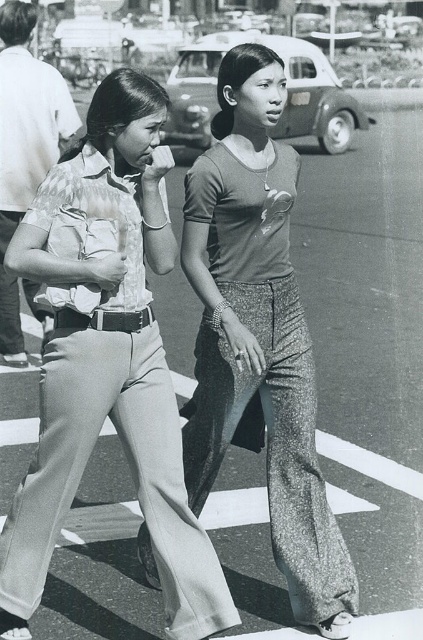
Question: Which of the following is the farthest from the observer?

Choices:
 (A) matte beige pants at center
 (B) matte gray pants at center

Answer: (B)

Question: Where is matte beige pants at center located in relation to matte gray pants at center in the image?

Choices:
 (A) right
 (B) left

Answer: (B)

Question: Is matte beige pants at center positioned at the back of matte gray pants at center?

Choices:
 (A) yes
 (B) no

Answer: (B)

Question: Which object appears closest to the camera in this image?

Choices:
 (A) matte gray pants at center
 (B) matte beige pants at center

Answer: (B)

Question: Does matte beige pants at center appear over matte gray pants at center?

Choices:
 (A) yes
 (B) no

Answer: (B)